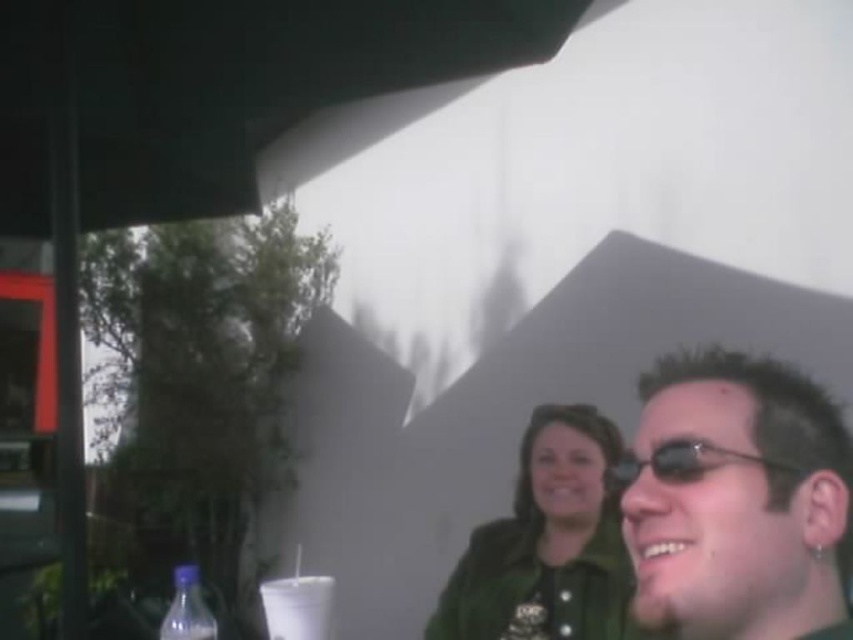
From the picture: You are a photographer trying to capture a closeup of the sunglasses at right and the translucent plastic bottle at lower left. Which object should you zoom in on to ensure both are in frame without moving the camera?

You should zoom in on the sunglasses at right because it is smaller than the translucent plastic bottle at lower left, so focusing on the smaller object will help keep both in frame.

You are a photographer trying to capture a photo of the translucent plastic bottle at lower left without the sunglasses at right blocking the view. Based on the scene description, is this possible? Please explain your reasoning.

The sunglasses at right is in front of the translucent plastic bottle at lower left, so the sunglasses would block the view of the bottle. Therefore, it is not possible to capture the bottle without the sunglasses obstructing it.